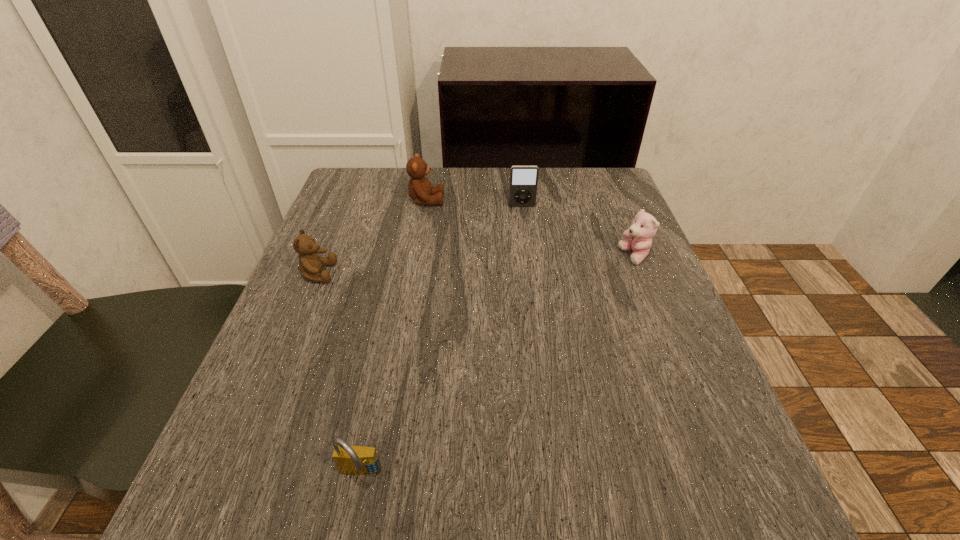
Where is `free location that satisfies the following two spatial constraints: 1. on the front-facing side of the iPod; 2. on the front-facing side of the leftmost teddy bear`? free location that satisfies the following two spatial constraints: 1. on the front-facing side of the iPod; 2. on the front-facing side of the leftmost teddy bear is located at coordinates (531, 273).